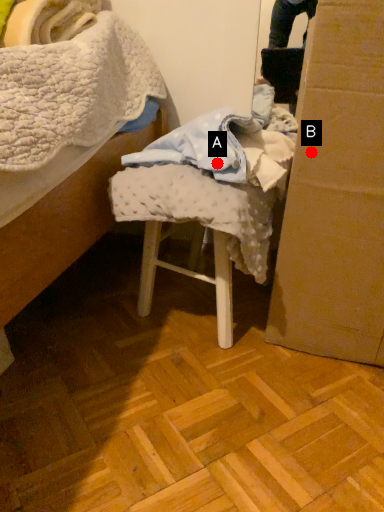
Question: Two points are circled on the image, labeled by A and B beside each circle. Which point appears farthest from the camera in this image?

Choices:
 (A) A is further
 (B) B is further

Answer: (B)